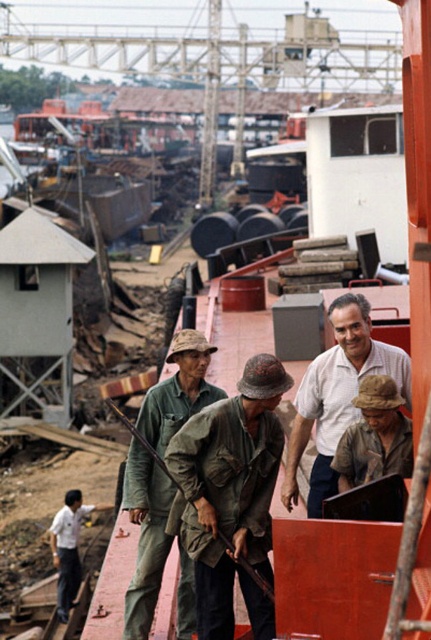
You are a photographer standing at the edge of the dock, trying to capture a clear shot of the camouflage fabric uniform at center and the camouflage fabric hat at center. Which object will appear larger in your photo?

The camouflage fabric uniform at center will appear larger in the photo because it is closer to the viewer than the camouflage fabric hat at center.